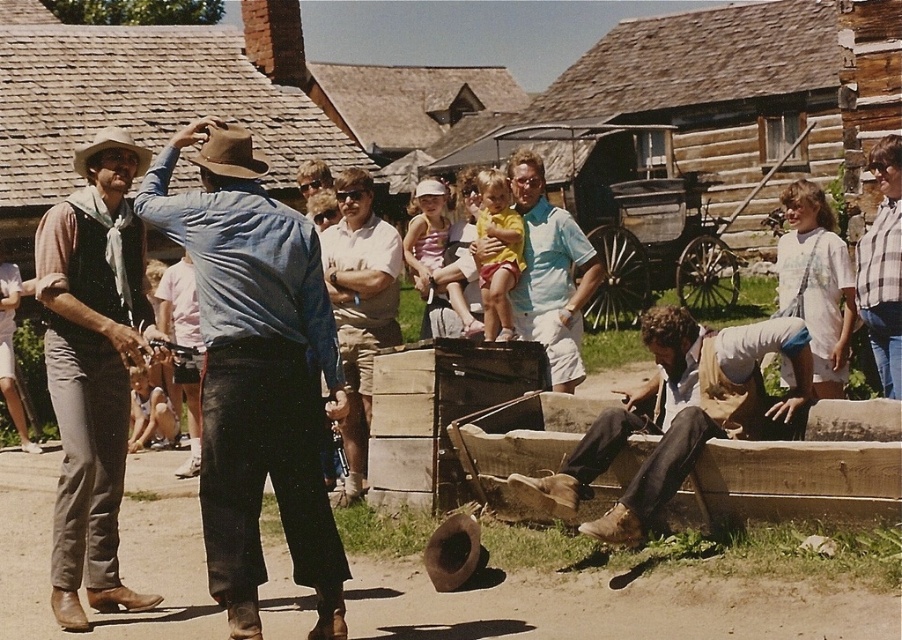
Identify the location of rustic brown vest at center. The image size is (902, 640). (93, 365).

Does rustic brown vest at center have a lesser width compared to wooden wagon at center?

No.

Who is more forward, (140, 164) or (643, 228)?

Point (140, 164) is in front.

You are a GUI agent. You are given a task and a screenshot of the screen. Output one action in this format:
    pyautogui.click(x=<x>, y=<y>)
    Task: Click on the rustic brown vest at center
    
    Given the screenshot: What is the action you would take?
    pyautogui.click(x=93, y=365)

Locate an element on the screen. brown leather boots at lower center is located at coordinates (677, 416).

Can you confirm if brown leather boots at lower center is smaller than light blue cotton shirt at center?

No, brown leather boots at lower center is not smaller than light blue cotton shirt at center.

Is point (742, 381) positioned after point (514, 182)?

No, it is in front of (514, 182).

This screenshot has height=640, width=902. Identify the location of brown leather boots at lower center. (677, 416).

Is point (378, 250) positioned after point (137, 168)?

Yes, it is.

The image size is (902, 640). I want to click on light brown leather boots at center, so click(x=360, y=307).